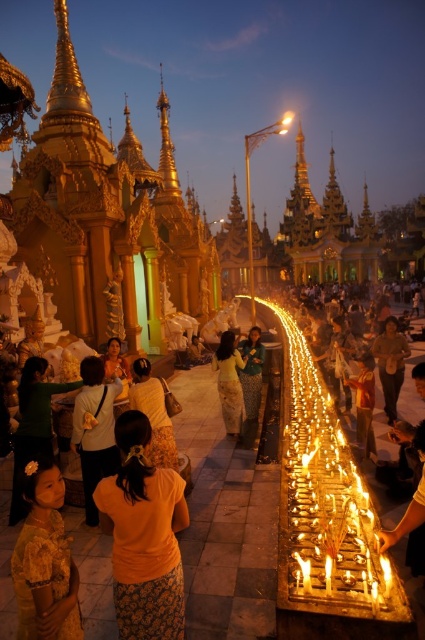
In the scene shown: You are standing at the temple and see two points marked in the image. Which point is closer to you, point (x=39, y=376) or point (x=244, y=406)?

Point (x=39, y=376) is in front of point (x=244, y=406), so it is closer to you.

You are a photographer standing at the entrance of the temple pathway. You want to take a photo that includes both the yellow fabric at center and the matte green dress at center. Given that your camera has a maximum focus range of 12 meters, will you be able to capture both subjects in focus without moving closer?

The distance between the yellow fabric at center and the matte green dress at center is 13.24 meters. Since your camera can only focus up to 12 meters, you won cannot capture both subjects in focus without moving closer.

You are a photographer at the temple and want to capture both the matte green dress at lower left and the matte green dress at center in a single frame. Which dress should you position closer to the left side of your camera viewfinder to ensure both are visible?

To ensure both the matte green dress at lower left and the matte green dress at center are visible in the frame, position the matte green dress at lower left closer to the left side of the camera viewfinder since it is already to the left of the matte green dress at center.